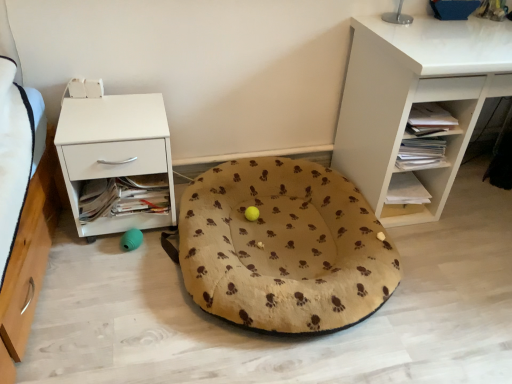
Locate an element on the screen. The image size is (512, 384). free area in between white matte nightstand at left and beige fabric dog bed at center is located at coordinates (145, 290).